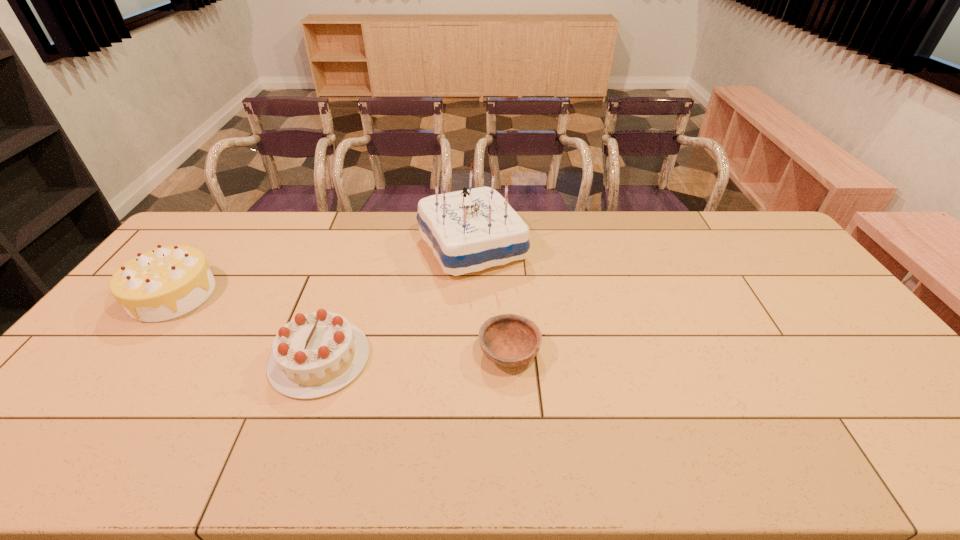
Where is `vacant position located 0.390m on the left of the shortest object`? This screenshot has width=960, height=540. vacant position located 0.390m on the left of the shortest object is located at coordinates (335, 352).

The height and width of the screenshot is (540, 960). Find the location of `object present at the far edge`. object present at the far edge is located at coordinates (470, 230).

Where is `object present at the left edge`? The height and width of the screenshot is (540, 960). object present at the left edge is located at coordinates pyautogui.click(x=165, y=283).

This screenshot has width=960, height=540. What are the coordinates of `vacant space at the far edge of the desktop` in the screenshot? It's located at (647, 213).

Locate an element on the screen. blank space at the near edge is located at coordinates (483, 443).

The image size is (960, 540). In the image, there is a desktop. In order to click on free region at the far left corner in this screenshot , I will do `click(194, 239)`.

You are a GUI agent. You are given a task and a screenshot of the screen. Output one action in this format:
    pyautogui.click(x=<x>, y=<y>)
    Task: Click on the vacant area at the near right corner
    
    Given the screenshot: What is the action you would take?
    pyautogui.click(x=941, y=457)

The image size is (960, 540). What are the coordinates of `blank region between the tallest birthday cake and the second shortest birthday cake` in the screenshot? It's located at (323, 271).

At what (x,y) coordinates should I click in order to perform the action: click on vacant space that's between the bowl and the shortest birthday cake. Please return your answer as a coordinate pair (x, y). This screenshot has width=960, height=540. Looking at the image, I should click on (415, 355).

At what (x,y) coordinates should I click in order to perform the action: click on free space between the shortest birthday cake and the tallest birthday cake. Please return your answer as a coordinate pair (x, y). Looking at the image, I should click on (396, 302).